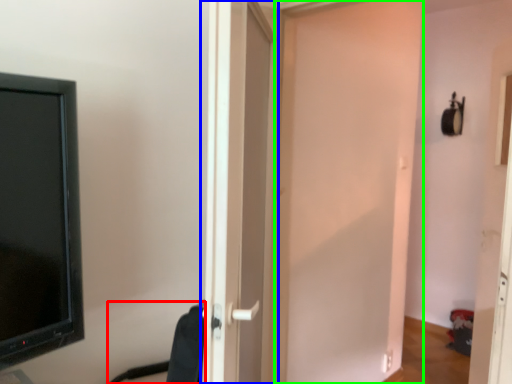
Question: Which object is positioned closest to swivel chair (highlighted by a red box)? Select from door (highlighted by a blue box) and door (highlighted by a green box).

Choices:
 (A) door
 (B) door

Answer: (A)